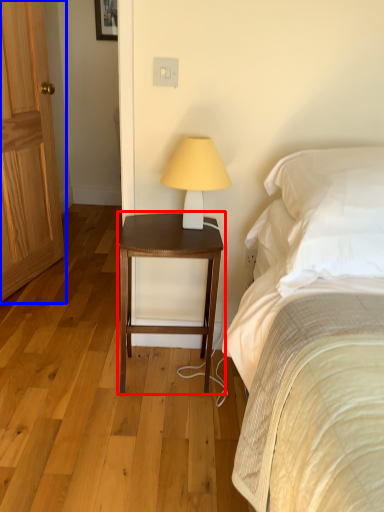
Question: Which object is closer to the camera taking this photo, nightstand (highlighted by a red box) or door (highlighted by a blue box)?

Choices:
 (A) nightstand
 (B) door

Answer: (A)